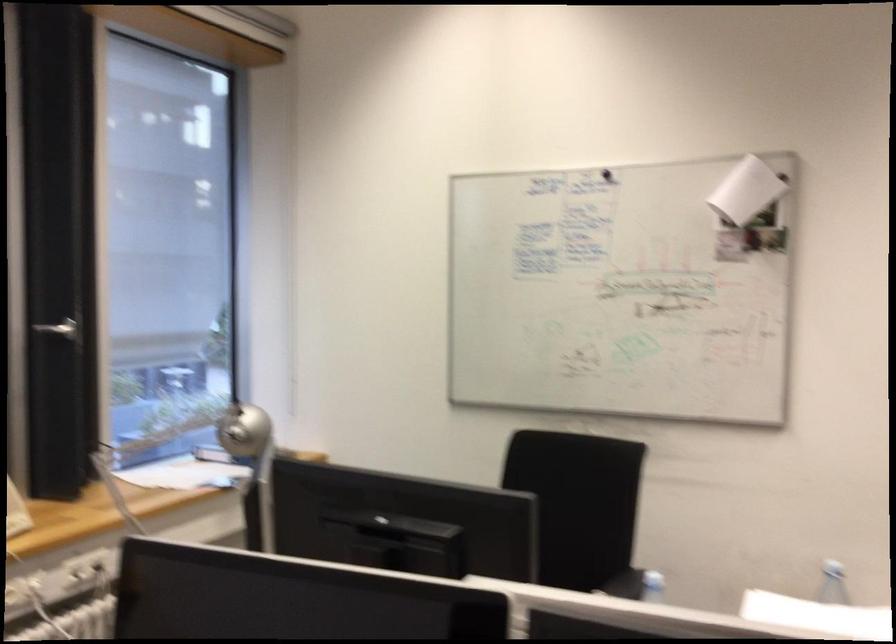
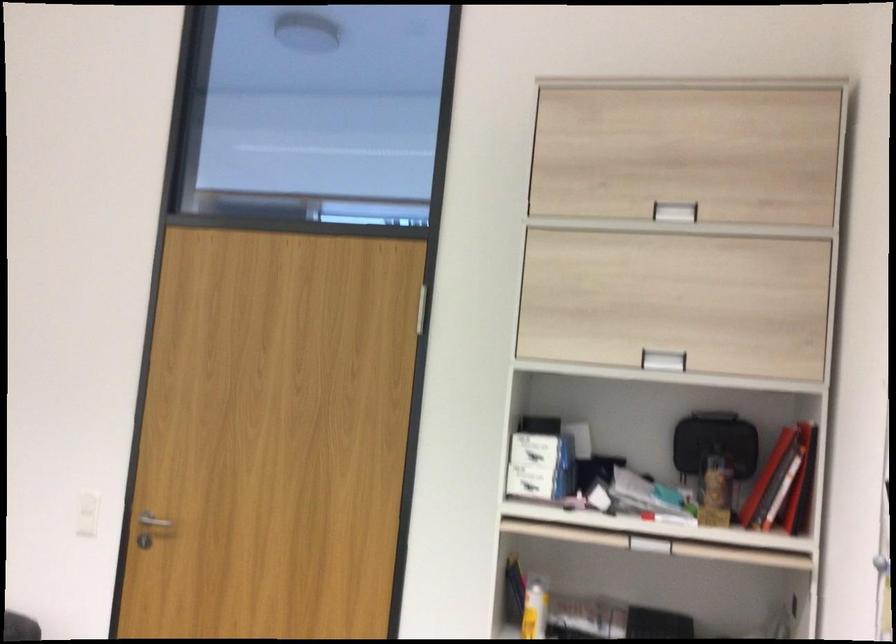
Question: The first image is from the beginning of the video and the second image is from the end. How did the camera likely rotate when shooting the video?

Choices:
 (A) Left
 (B) Right
 (C) Up
 (D) Down

Answer: (B)